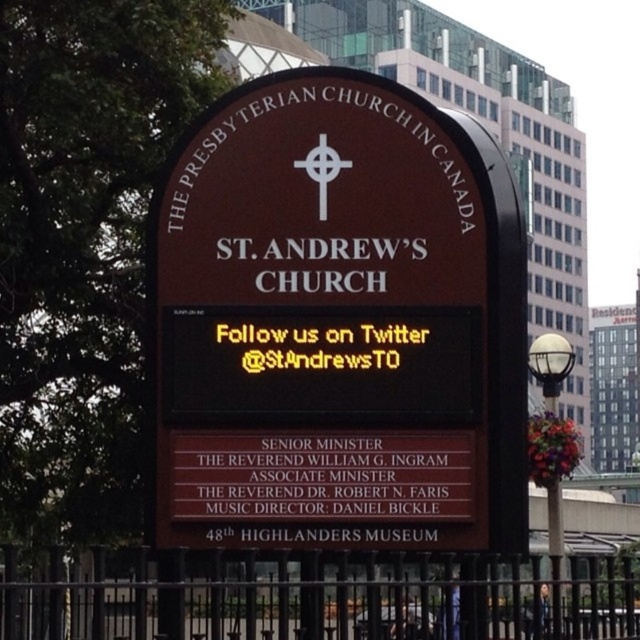
Is brown polished wood sign at center taller than black metal fence at lower center?

Yes.

Is point (316, 506) positioned behind point (611, 611)?

No, (316, 506) is in front of (611, 611).

Is point (512, 545) closer to viewer compared to point (269, 600)?

Yes, point (512, 545) is in front of point (269, 600).

At what (x,y) coordinates should I click in order to perform the action: click on brown polished wood sign at center. Please return your answer as a coordinate pair (x, y). The image size is (640, 640). Looking at the image, I should click on (339, 324).